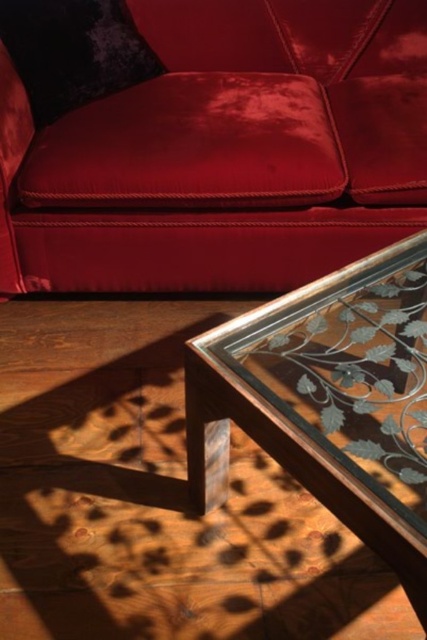
Question: Is velvet red couch at upper center wider than clear glass table at center?

Choices:
 (A) no
 (B) yes

Answer: (B)

Question: Which of the following is the closest to the observer?

Choices:
 (A) clear glass table at center
 (B) velvet red couch at upper center

Answer: (A)

Question: Does velvet red couch at upper center appear on the left side of clear glass table at center?

Choices:
 (A) no
 (B) yes

Answer: (B)

Question: Which object appears closest to the camera in this image?

Choices:
 (A) clear glass table at center
 (B) velvet red couch at upper center

Answer: (A)

Question: Which object is farther from the camera taking this photo?

Choices:
 (A) clear glass table at center
 (B) velvet red couch at upper center

Answer: (B)

Question: Can you confirm if velvet red couch at upper center is positioned above clear glass table at center?

Choices:
 (A) no
 (B) yes

Answer: (B)